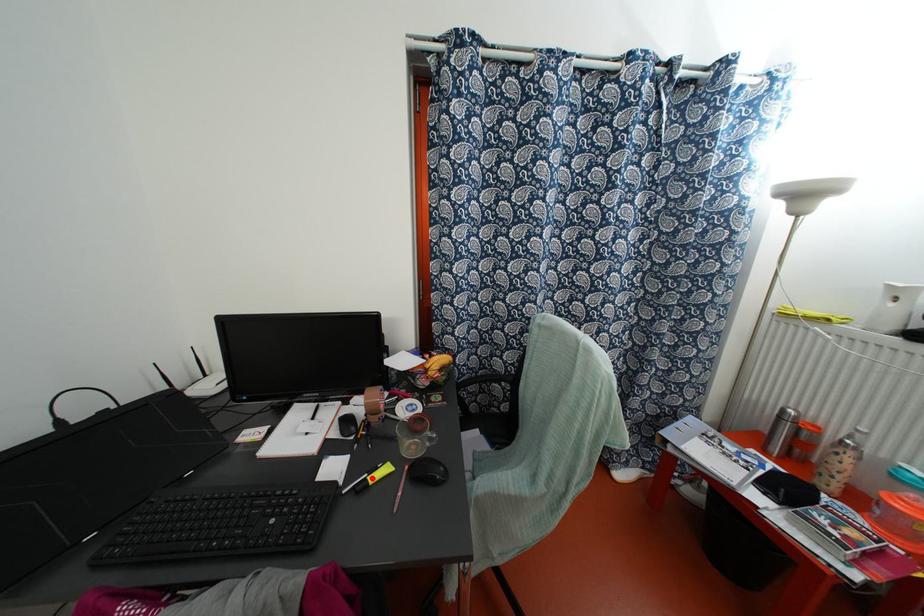
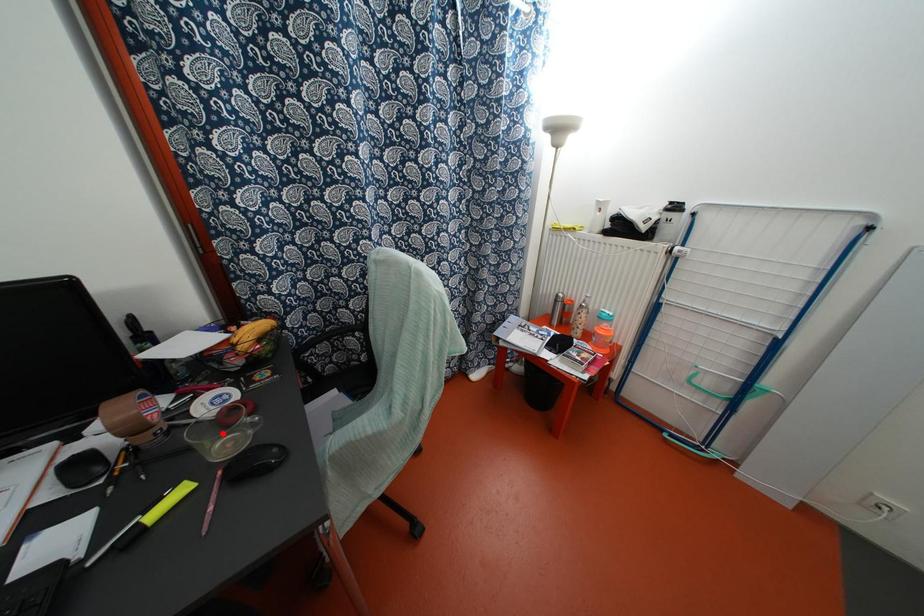
I am providing you with two images of the same scene from different viewpoints. A red point is marked on the first image and another point is marked on the second image. Do the highlighted points in image1 and image2 indicate the same real-world spot?

No